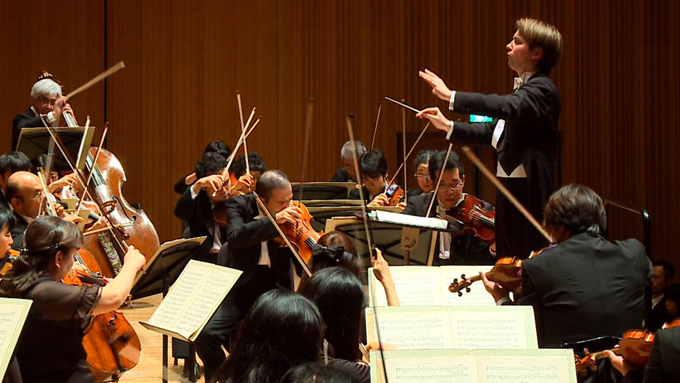
Locate an element on the screen. music stand is located at coordinates (164, 345), (187, 356), (16, 364), (56, 150), (313, 191), (362, 235), (320, 217), (153, 273).